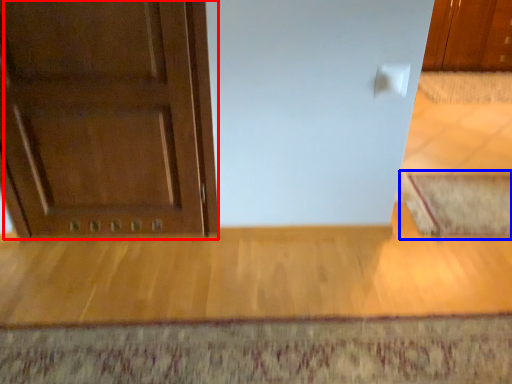
Question: Among these objects, which one is nearest to the camera, door (highlighted by a red box) or doormat (highlighted by a blue box)?

Choices:
 (A) door
 (B) doormat

Answer: (A)